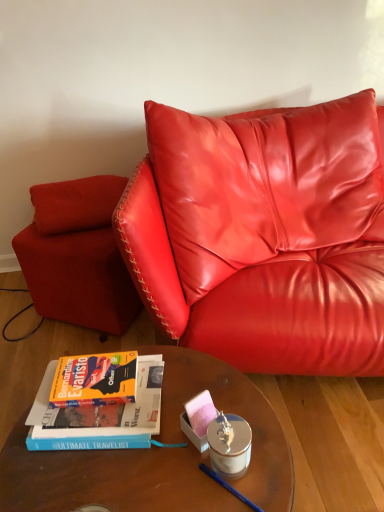
Question: Considering the positions of silver metallic candle holder at center and wooden glass table at center in the image, is silver metallic candle holder at center wider or thinner than wooden glass table at center?

Choices:
 (A) wide
 (B) thin

Answer: (B)

Question: Is point (241, 470) closer or farther from the camera than point (261, 480)?

Choices:
 (A) closer
 (B) farther

Answer: (B)

Question: Which is farther from the hardcover book at lower left?

Choices:
 (A) matte red armchair at lower left
 (B) wooden glass table at center
 (C) silver metallic candle holder at center
 (D) velvet red pillow at upper left

Answer: (D)

Question: Which is nearer to the wooden glass table at center?

Choices:
 (A) velvet red pillow at upper left
 (B) silver metallic candle holder at center
 (C) hardcover book at lower left
 (D) matte red armchair at lower left

Answer: (C)